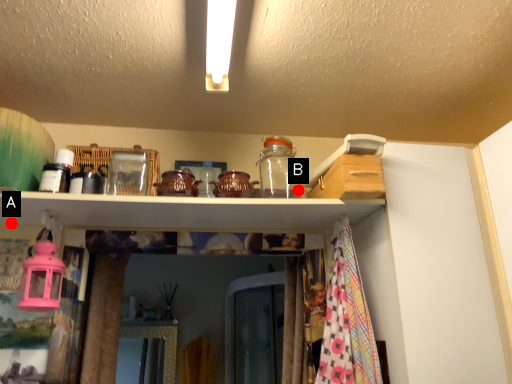
Question: Two points are circled on the image, labeled by A and B beside each circle. Which point is farther from the camera taking this photo?

Choices:
 (A) A is further
 (B) B is further

Answer: (B)